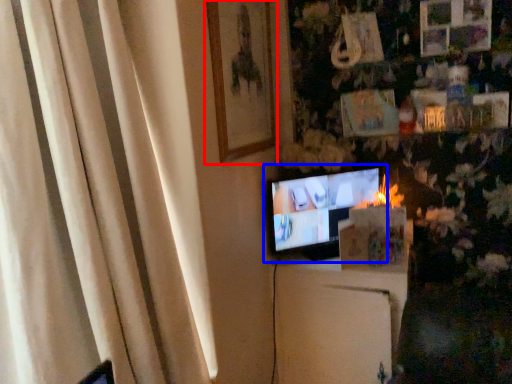
Question: Which of the following is the farthest to the observer, picture frame (highlighted by a red box) or television (highlighted by a blue box)?

Choices:
 (A) picture frame
 (B) television

Answer: (B)